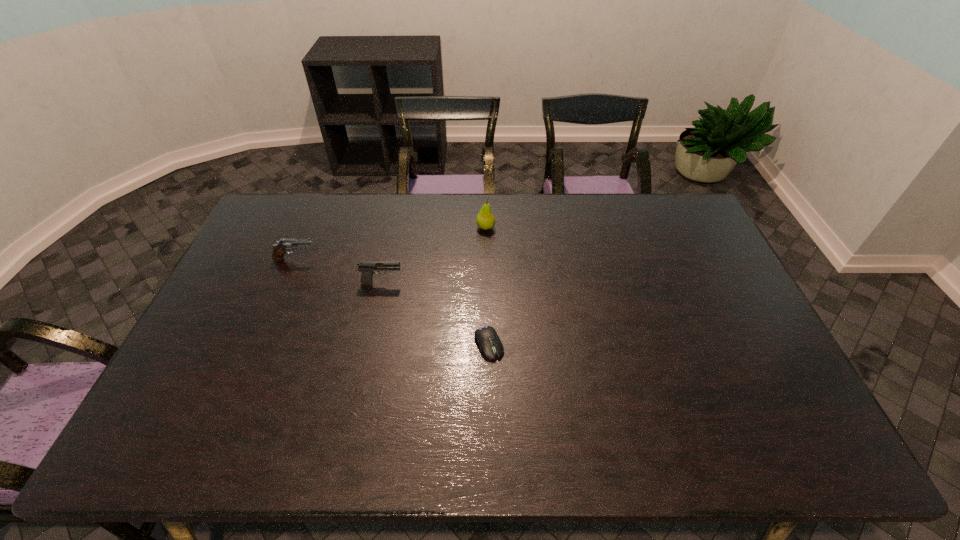
The width and height of the screenshot is (960, 540). I want to click on the tallest object, so click(x=485, y=219).

At what (x,y) coordinates should I click in order to perform the action: click on pear. Please return your answer as a coordinate pair (x, y). Looking at the image, I should click on (485, 219).

Find the location of a particular element. The width and height of the screenshot is (960, 540). the leftmost object is located at coordinates (280, 249).

The image size is (960, 540). Find the location of `the farther pistol`. the farther pistol is located at coordinates (280, 249).

At what (x,y) coordinates should I click in order to perform the action: click on the third farthest object. Please return your answer as a coordinate pair (x, y). The image size is (960, 540). Looking at the image, I should click on (367, 268).

Find the location of a particular element. The height and width of the screenshot is (540, 960). the right pistol is located at coordinates (367, 268).

Identify the location of the nearest object. This screenshot has height=540, width=960. (490, 345).

Find the location of a particular element. the shortest object is located at coordinates (490, 345).

The image size is (960, 540). What are the coordinates of `vacant space located 0.380m on the left of the tallest object` in the screenshot? It's located at (371, 228).

You are a GUI agent. You are given a task and a screenshot of the screen. Output one action in this format:
    pyautogui.click(x=<x>, y=<y>)
    Task: Click on the free space located 0.340m at the barrel of the left pistol
    
    Given the screenshot: What is the action you would take?
    pyautogui.click(x=420, y=260)